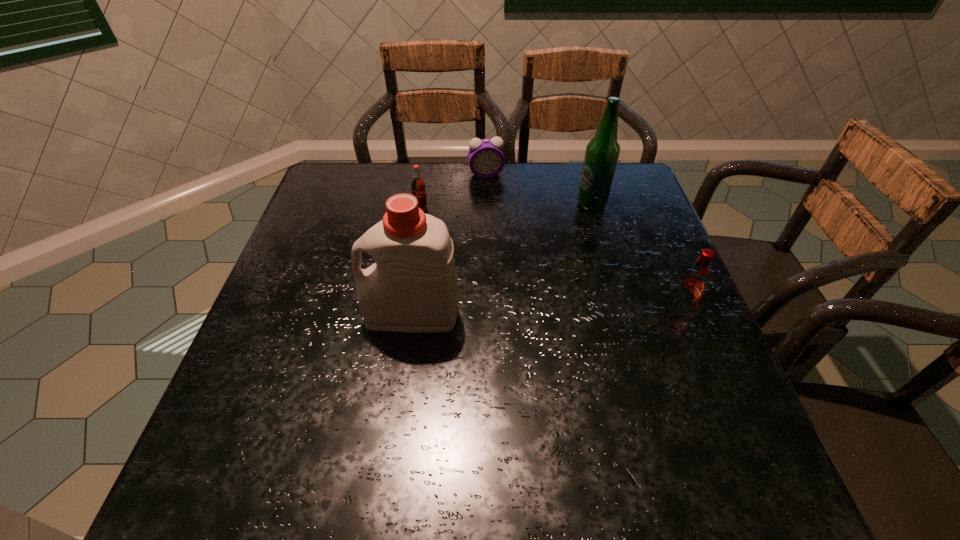
Find the location of `detergent`. detergent is located at coordinates (411, 288).

Identify the location of root beer. (693, 284).

At what (x,y) coordinates should I click in order to perform the action: click on the second object from right to left. Please return your answer as a coordinate pair (x, y). The width and height of the screenshot is (960, 540). Looking at the image, I should click on (602, 152).

This screenshot has width=960, height=540. I want to click on the fourth tallest object, so click(x=418, y=188).

At what (x,y) coordinates should I click in order to perform the action: click on alarm clock. Please return your answer as a coordinate pair (x, y). The image size is (960, 540). Looking at the image, I should click on (486, 159).

The width and height of the screenshot is (960, 540). In order to click on the shortest object in this screenshot , I will do `click(486, 159)`.

Identify the location of vacant area located on the handle side of the detergent. (293, 315).

This screenshot has width=960, height=540. Find the location of `free space located on the handle side of the detergent`. free space located on the handle side of the detergent is located at coordinates (343, 315).

Identify the location of free region located on the handle side of the detergent. (260, 315).

At what (x,y) coordinates should I click in order to perform the action: click on blank space located on the back of the root beer. Please return your answer as a coordinate pair (x, y). This screenshot has width=960, height=540. Looking at the image, I should click on (641, 220).